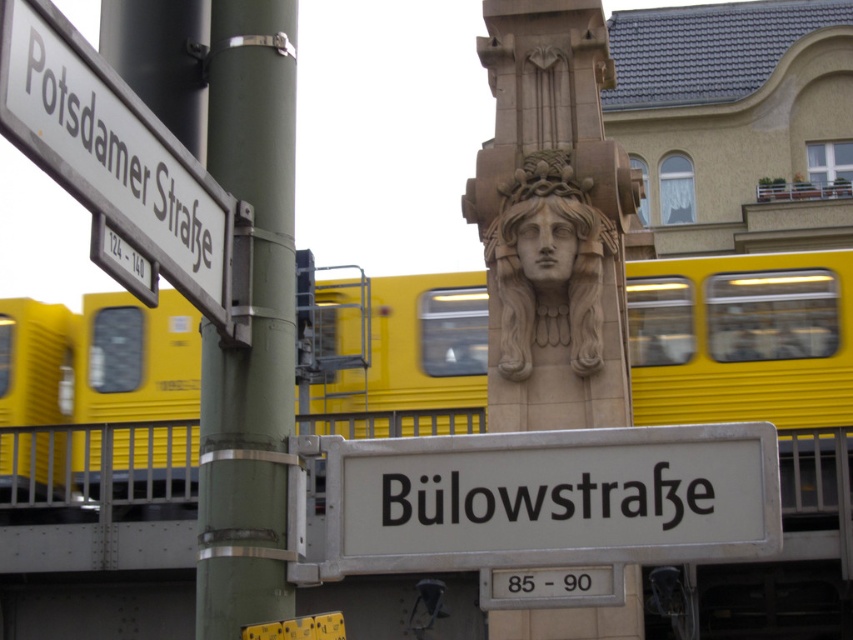
Which is in front, point (384, 276) or point (274, 392)?

Point (274, 392)

Who is taller, yellow matte train at center or green metallic pole at left?

yellow matte train at center is taller.

Is point (811, 387) closer to viewer compared to point (265, 259)?

That is False.

Find the location of a particular element. The width and height of the screenshot is (853, 640). yellow matte train at center is located at coordinates (747, 349).

Looking at this image, measure the distance between yellow matte train at center and carved stone head at center.

A distance of 16.37 feet exists between yellow matte train at center and carved stone head at center.

Between point (132, 349) and point (537, 321), which one is positioned behind?

The point (132, 349) is more distant.

This screenshot has height=640, width=853. Find the location of `yellow matte train at center`. yellow matte train at center is located at coordinates (747, 349).

Is white metallic sign at center to the left of green metallic pole at left from the viewer's perspective?

Incorrect, white metallic sign at center is not on the left side of green metallic pole at left.

Is white metallic sign at center bigger than green metallic pole at left?

Actually, white metallic sign at center might be smaller than green metallic pole at left.

Is point (424, 504) behind point (254, 300)?

That is True.

Locate an element on the screen. This screenshot has width=853, height=640. white metallic sign at center is located at coordinates (550, 499).